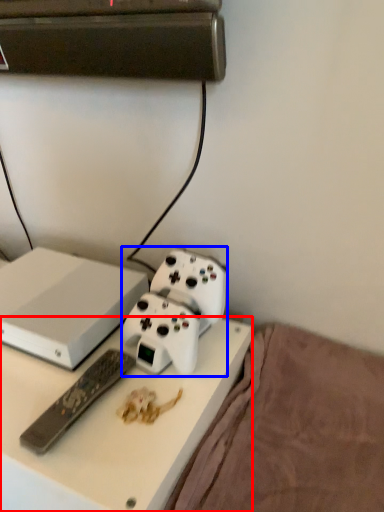
Question: Which of the following is the farthest to the observer, desk (highlighted by a red box) or equipment (highlighted by a blue box)?

Choices:
 (A) desk
 (B) equipment

Answer: (B)